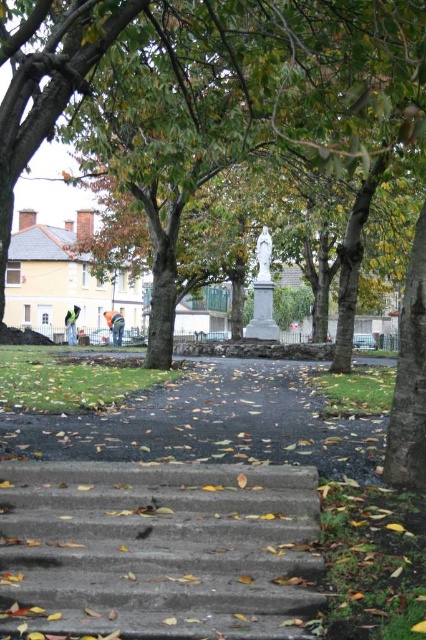
You are standing at the viewpoint of the image and want to reach the point labeled as point (x=69, y=83). If your walking speed is 1.2 meters per second, how many seconds will it take you to reach that point?

The distance between you and point (x=69, y=83) is 5.87 meters. At a speed of 1.2 meters per second, it will take approximately 4.89 seconds to reach the point.

You are standing at the bottom of the concrete stairs at lower center and want to reach the brown leafy tree at center. Which direction should you move to get closer to the tree?

To reach the brown leafy tree at center from the concrete stairs at lower center, you should move upward since the tree is taller than the stairs.